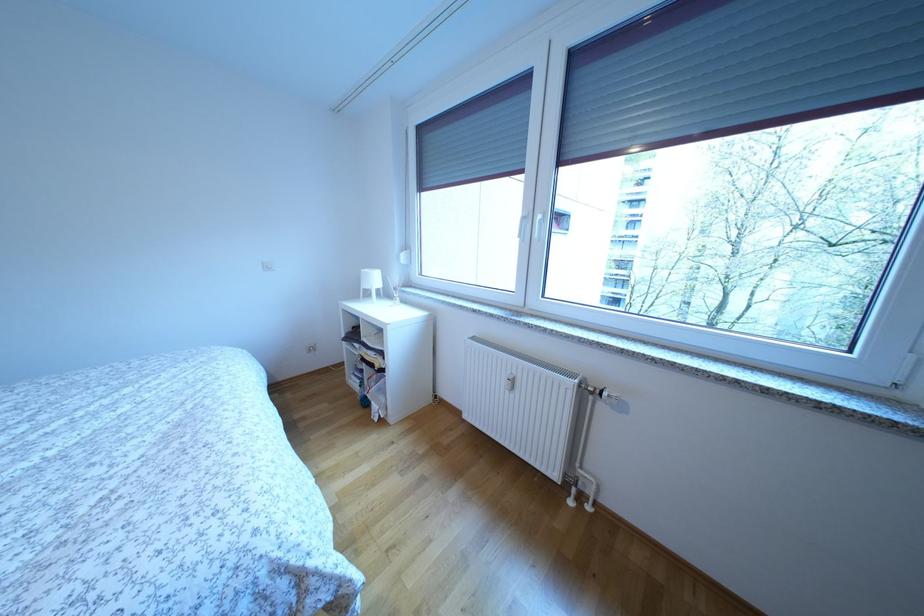
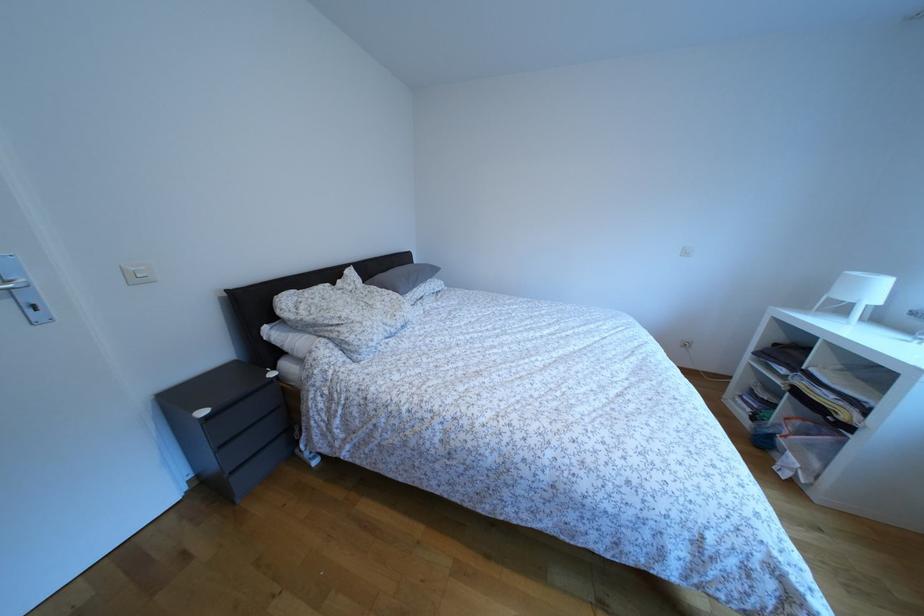
Question: The camera is either moving clockwise (left) or counter-clockwise (right) around the object. The first image is from the beginning of the video and the second image is from the end. Is the camera moving left or right when shooting the video?

Choices:
 (A) Left
 (B) Right

Answer: (B)